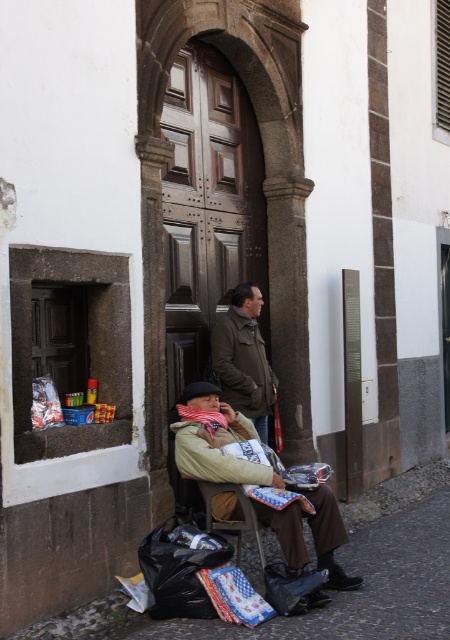
Question: Is beige fabric jacket at lower center positioned in front of wooden chair at lower center?

Choices:
 (A) no
 (B) yes

Answer: (A)

Question: Which of the following is the closest to the observer?

Choices:
 (A) (342, 573)
 (B) (250, 337)
 (C) (202, 490)

Answer: (C)

Question: Which point is closer to the camera?

Choices:
 (A) (223, 481)
 (B) (229, 384)
 (C) (260, 536)

Answer: (C)

Question: Does beige fabric jacket at lower center lie behind wooden chair at lower center?

Choices:
 (A) yes
 (B) no

Answer: (A)

Question: Is beige fabric jacket at lower center below wooden chair at lower center?

Choices:
 (A) yes
 (B) no

Answer: (B)

Question: Which of the following is the closest to the observer?

Choices:
 (A) brown leather trench coat at center
 (B) wooden chair at lower center

Answer: (B)